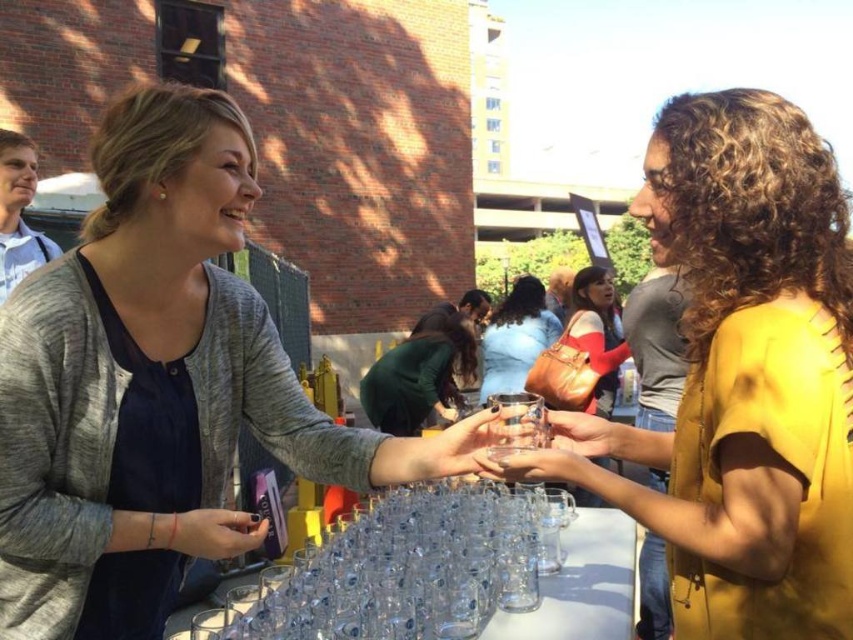
You are a photographer trying to capture the scene. The yellow matte shirt at center is at coordinates point (x=741, y=376). If you want to focus on the yellow matte shirt at center, where should you aim your camera?

You should aim your camera at the coordinates point (x=741, y=376) to focus on the yellow matte shirt at center.

Looking at this image, you are a bartender at the event and need to determine if the transparent glass cups at center can fit into a storage compartment designed for items narrower than the green fabric shirt at center. Can they fit?

The transparent glass cups at center have a width less than the green fabric shirt at center, so they can fit into the storage compartment designed for items narrower than the green fabric shirt at center.

You are at a party and see two items at center. Which one is more to the right, the yellow matte shirt at center or the transparent glass cups at center?

The yellow matte shirt at center is more to the right than the transparent glass cups at center.